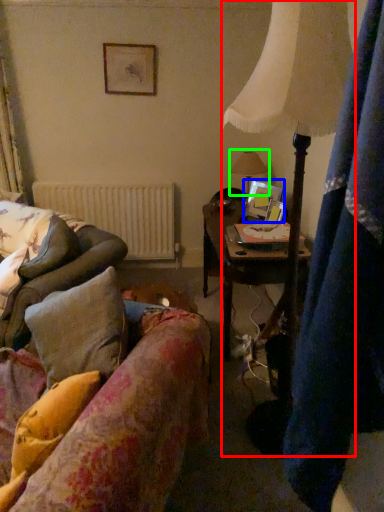
Question: Which object is positioned farthest from lamp (highlighted by a red box)? Select from picture frame (highlighted by a blue box) and table lamp (highlighted by a green box).

Choices:
 (A) picture frame
 (B) table lamp

Answer: (B)